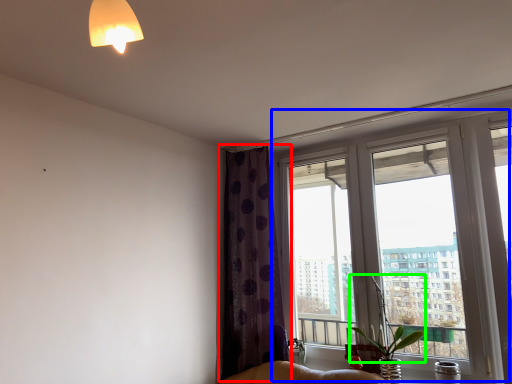
Question: Based on their relative distances, which object is farther from curtain (highlighted by a red box)? Choose from window (highlighted by a blue box) and plant (highlighted by a green box).

Choices:
 (A) window
 (B) plant

Answer: (B)